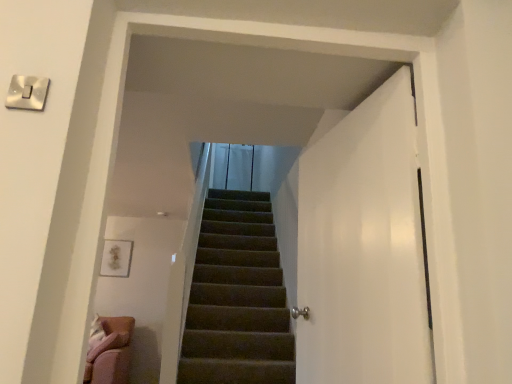
Question: Is point (317, 235) closer or farther from the camera than point (35, 99)?

Choices:
 (A) farther
 (B) closer

Answer: (A)

Question: Relative to white glossy switch at upper left, is white glossy door at right in front or behind?

Choices:
 (A) front
 (B) behind

Answer: (B)

Question: In terms of height, does white glossy door at right look taller or shorter compared to white glossy switch at upper left?

Choices:
 (A) short
 (B) tall

Answer: (B)

Question: Is white glossy switch at upper left in front of or behind white glossy door at right in the image?

Choices:
 (A) front
 (B) behind

Answer: (A)

Question: Choose the correct answer: Is white glossy switch at upper left inside white glossy door at right or outside it?

Choices:
 (A) outside
 (B) inside

Answer: (A)

Question: Would you say white glossy switch at upper left is to the left or to the right of white glossy door at right in the picture?

Choices:
 (A) right
 (B) left

Answer: (B)

Question: From the image's perspective, is white glossy switch at upper left located above or below white glossy door at right?

Choices:
 (A) above
 (B) below

Answer: (A)